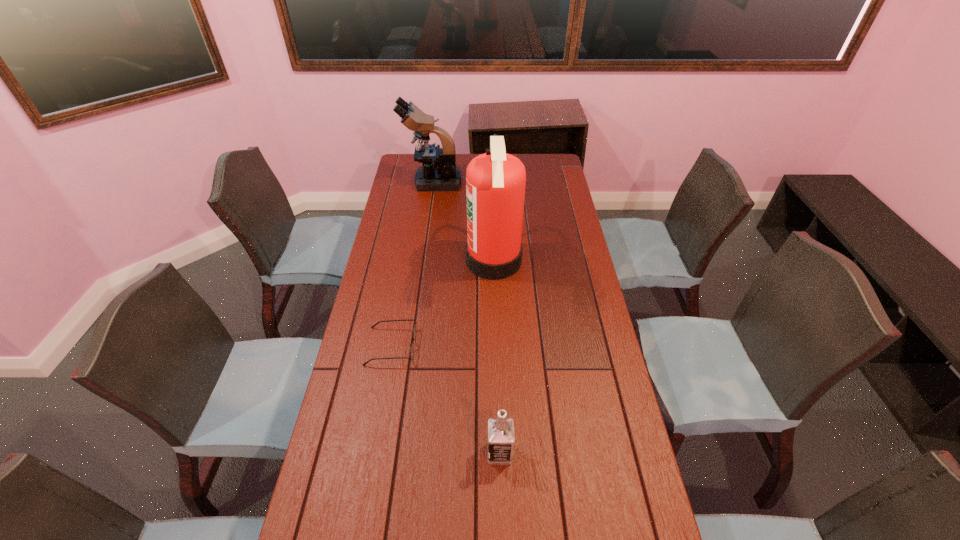
You are a GUI agent. You are given a task and a screenshot of the screen. Output one action in this format:
    pyautogui.click(x=<x>, y=<y>)
    Task: Click on the tallest object
    This screenshot has width=960, height=540.
    Given the screenshot: What is the action you would take?
    pyautogui.click(x=495, y=181)

Find the location of a particular element. the second farthest object is located at coordinates (495, 181).

Find the location of `the farthest object`. the farthest object is located at coordinates (435, 174).

At what (x,y) coordinates should I click in order to perform the action: click on microscope. Please return your answer as a coordinate pair (x, y). Image resolution: width=960 pixels, height=540 pixels. Looking at the image, I should click on (435, 174).

Image resolution: width=960 pixels, height=540 pixels. In order to click on vodka in this screenshot , I will do `click(501, 437)`.

The image size is (960, 540). Find the location of `the third tallest object`. the third tallest object is located at coordinates (501, 437).

The image size is (960, 540). Find the location of `the third farthest object`. the third farthest object is located at coordinates (414, 326).

Locate an element on the screen. spectacles is located at coordinates (414, 326).

In order to click on free space located at the nozzle of the second farthest object in this screenshot , I will do `click(429, 261)`.

Locate an element on the screen. vacant space located at the nozzle of the second farthest object is located at coordinates (445, 261).